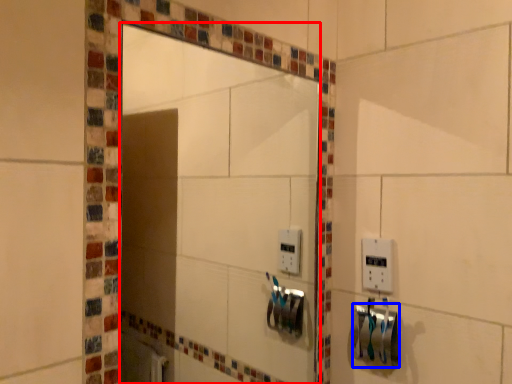
Question: Which point is closer to the camera, mirror (highlighted by a red box) or towel bar (highlighted by a blue box)?

Choices:
 (A) mirror
 (B) towel bar

Answer: (A)